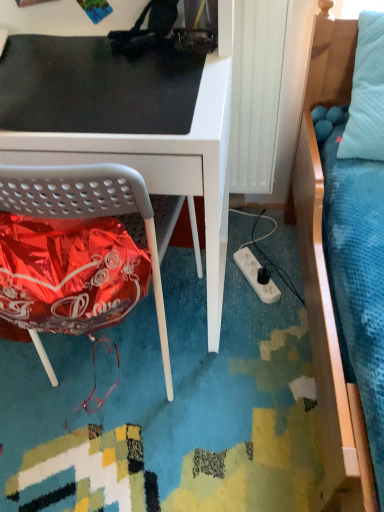
Identify the location of blank space to the left of white plastic power outlet at lower center. (202, 298).